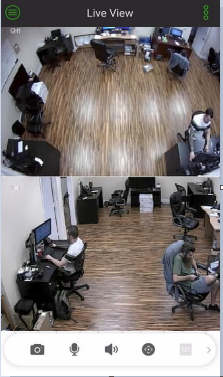
Find the location of a particular element. Image resolution: width=223 pixels, height=377 pixels. doorway is located at coordinates (67, 195).